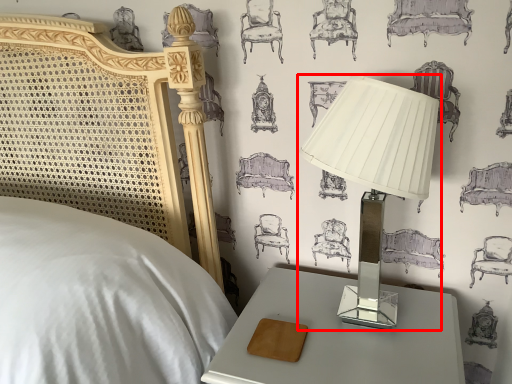
Question: In this image, where is lamp (annotated by the red box) located relative to nightstand?

Choices:
 (A) left
 (B) right

Answer: (B)